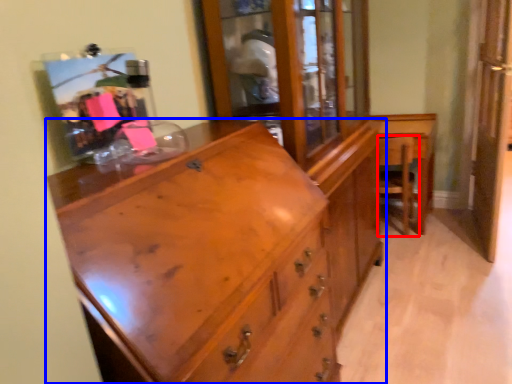
Question: Which point is further to the camera, armchair (highlighted by a red box) or chest of drawers (highlighted by a blue box)?

Choices:
 (A) armchair
 (B) chest of drawers

Answer: (A)